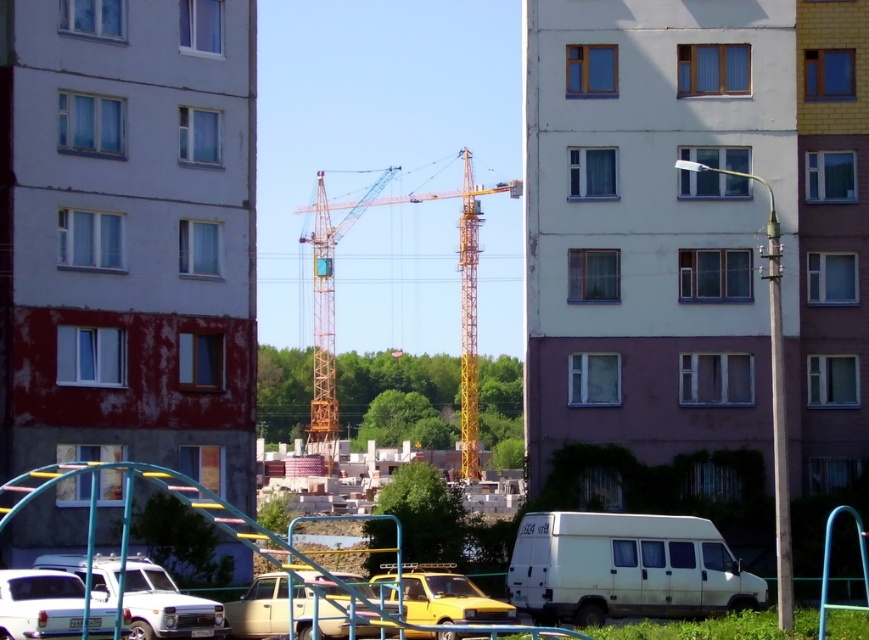
Question: Which object is the farthest from the yellow metallic crane at center?

Choices:
 (A) white glossy car at lower left
 (B) yellow matte car at center
 (C) white matte van at lower center

Answer: (C)

Question: Does white matte car at lower left have a lesser width compared to beige matte car at center?

Choices:
 (A) yes
 (B) no

Answer: (B)

Question: Does white matte car at lower left have a smaller size compared to white glossy car at lower left?

Choices:
 (A) yes
 (B) no

Answer: (B)

Question: Which point is closer to the camera?

Choices:
 (A) (237, 625)
 (B) (450, 611)
 (C) (468, 275)

Answer: (B)

Question: Is white matte van at lower center behind yellow metallic crane at center?

Choices:
 (A) yes
 (B) no

Answer: (B)

Question: Which point is closer to the camera taking this photo?

Choices:
 (A) (317, 193)
 (B) (3, 572)
 (C) (473, 592)
 (D) (272, 586)

Answer: (B)